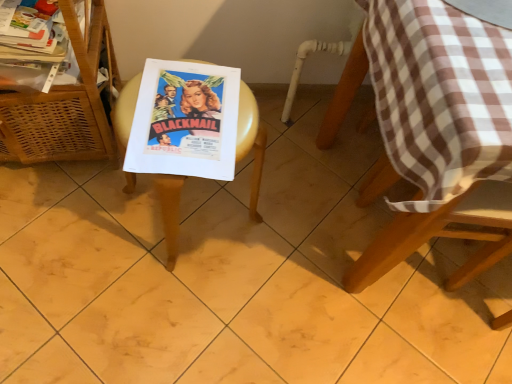
This screenshot has width=512, height=384. I want to click on vacant space underneath wooden picnic table at center (from a real-world perspective), so click(193, 213).